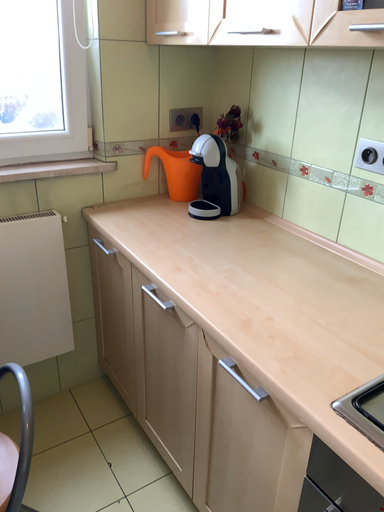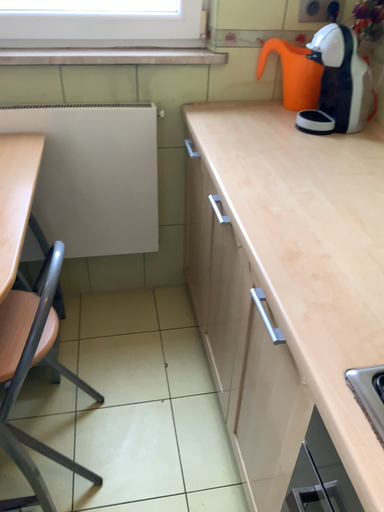
Question: Which way did the camera rotate in the video?

Choices:
 (A) rotated downward
 (B) rotated upward

Answer: (A)